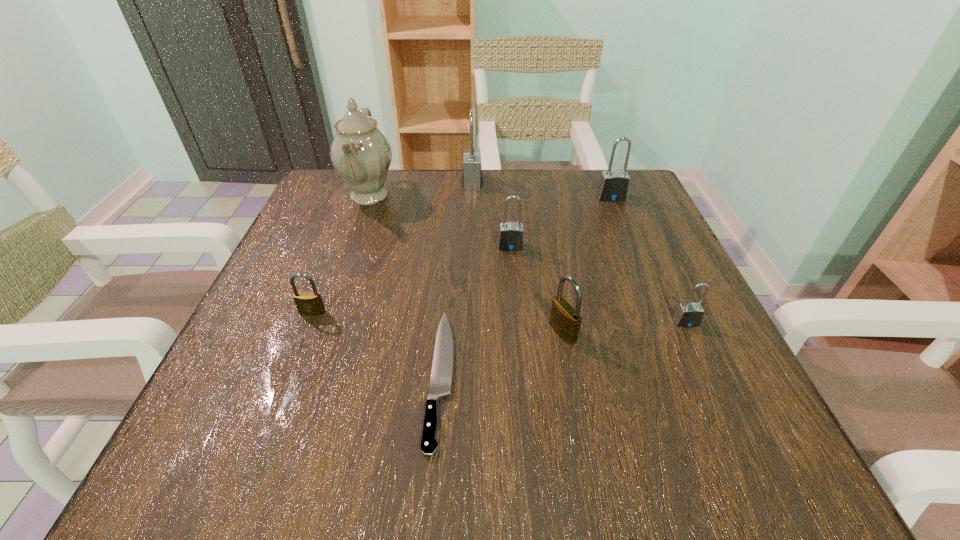
Locate an element on the screen. Image resolution: width=960 pixels, height=540 pixels. free point between the second tallest padlock and the farthest gray padlock is located at coordinates (541, 190).

Where is `free spot between the smallest gray padlock and the shortest object`? free spot between the smallest gray padlock and the shortest object is located at coordinates (564, 349).

Find the location of `free space between the second biggest gray padlock and the third padlock from right to left`. free space between the second biggest gray padlock and the third padlock from right to left is located at coordinates (587, 265).

Identify the location of blank region between the fifth nearest object and the shortest object. This screenshot has height=540, width=960. (476, 311).

Select which object is the fourth closest to the biggest gray padlock. Please provide its 2D coordinates. Your answer should be formatted as a tuple, i.e. [(x, y)], where the tuple contains the x and y coordinates of a point satisfying the conditions above.

[(442, 367)]

The height and width of the screenshot is (540, 960). I want to click on object that is the second nearest to the third padlock from right to left, so click(x=688, y=315).

Identify which padlock is the second nearest to the smallest gray padlock. Please provide its 2D coordinates. Your answer should be formatted as a tuple, i.e. [(x, y)], where the tuple contains the x and y coordinates of a point satisfying the conditions above.

[(511, 234)]

Locate an element on the screen. padlock that is the fifth closest to the chinaware is located at coordinates point(613,186).

The image size is (960, 540). In order to click on gray padlock that is the closest to the second nearest gray padlock in this screenshot , I will do `click(472, 172)`.

The width and height of the screenshot is (960, 540). In order to click on gray padlock that is the second closest one to the biggest gray padlock in this screenshot , I will do `click(613, 186)`.